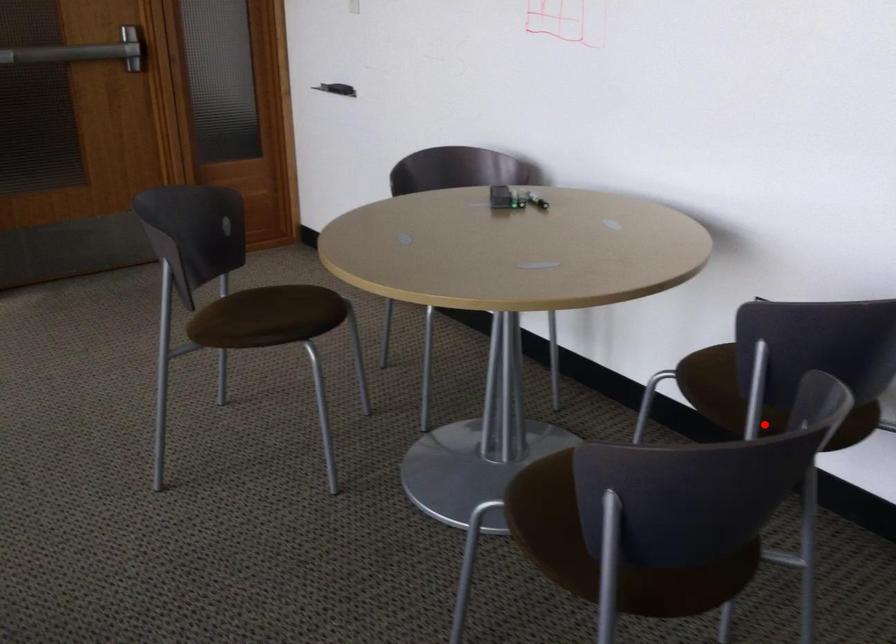
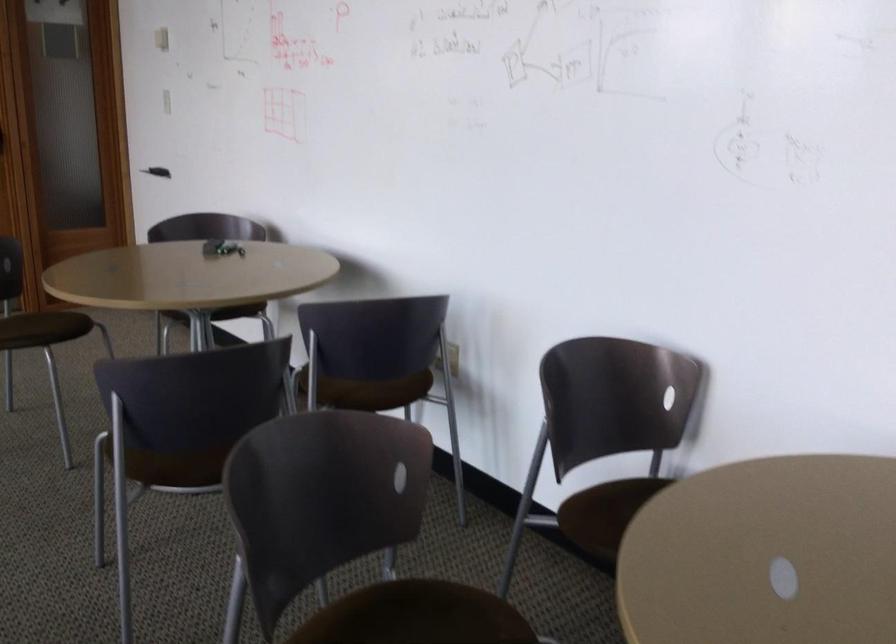
Question: I am providing you with two images of the same scene from different viewpoints. Given a red point in image1, look at the same physical point in image2. Is it:

Choices:
 (A) Closer to the viewpoint
 (B) Farther from the viewpoint

Answer: (B)